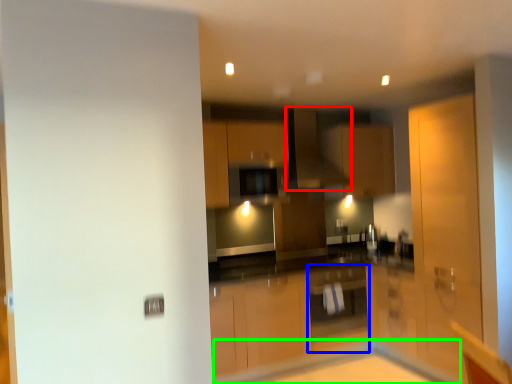
Question: Estimate the real-world distances between objects in this image. Which object is closer to exhaust hood (highlighted by a red box), cabinetry (highlighted by a blue box) or table (highlighted by a green box)?

Choices:
 (A) cabinetry
 (B) table

Answer: (A)